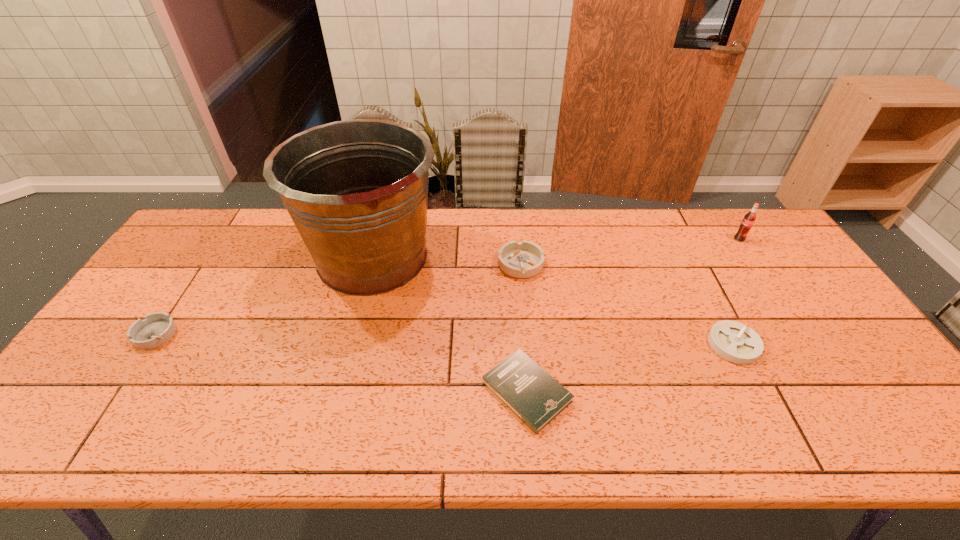
At what (x,y) coordinates should I click in order to perform the action: click on free region located 0.320m on the label of the soda bottle. Please return your answer as a coordinate pair (x, y). The image size is (960, 540). Looking at the image, I should click on (790, 316).

The image size is (960, 540). In order to click on free region located 0.360m on the front of the farthest ashtray in this screenshot , I will do `click(533, 387)`.

Where is `vacant space located on the right of the leftmost ashtray`? Image resolution: width=960 pixels, height=540 pixels. vacant space located on the right of the leftmost ashtray is located at coordinates (209, 334).

Where is `free space located 0.090m on the left of the fifth object from left to right`? This screenshot has height=540, width=960. free space located 0.090m on the left of the fifth object from left to right is located at coordinates (675, 345).

Image resolution: width=960 pixels, height=540 pixels. I want to click on vacant space located on the left of the book, so click(x=345, y=392).

You are a GUI agent. You are given a task and a screenshot of the screen. Output one action in this format:
    pyautogui.click(x=<x>, y=<y>)
    Task: Click on the bucket that is at the far edge
    The image size is (960, 540).
    Given the screenshot: What is the action you would take?
    pyautogui.click(x=357, y=190)

Where is `soda bottle that is at the far edge`? This screenshot has width=960, height=540. soda bottle that is at the far edge is located at coordinates (749, 219).

Where is `ashtray that is at the far edge`? The height and width of the screenshot is (540, 960). ashtray that is at the far edge is located at coordinates (524, 259).

Image resolution: width=960 pixels, height=540 pixels. Find the location of `object located at the near edge`. object located at the near edge is located at coordinates (520, 383).

Locate an element on the screen. object that is positioned at the left edge is located at coordinates (157, 328).